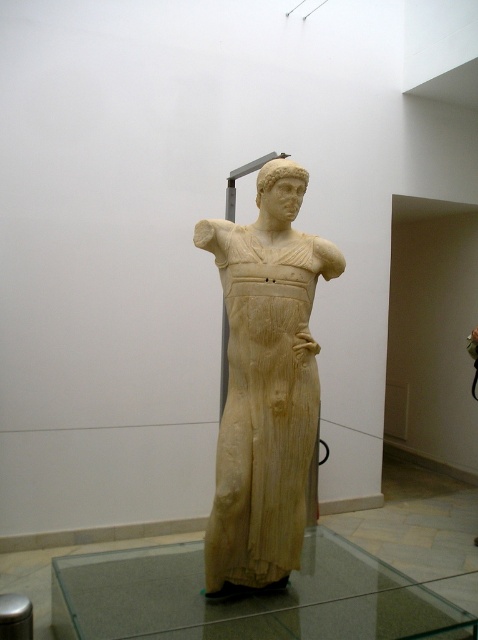
You are a museum curator who needs to place a new sculpture that is 60 centimeters wide on the transparent glass table at center. The beige marble statue at center is currently occupying space nearby. Can the new sculpture be placed on the table without moving the statue?

The beige marble statue at center is 63.44 centimeters away from the transparent glass table at center. Since the distance between them is greater than the sculpture width of 60 centimeters, the new sculpture can be placed on the table without moving the statue.